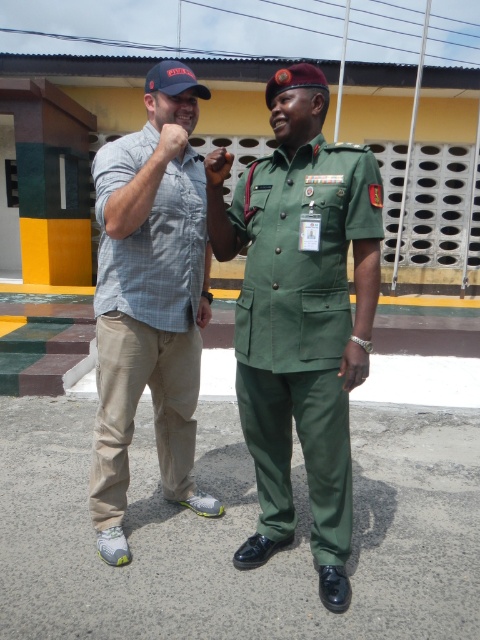
Question: Which point is closer to the camera?

Choices:
 (A) green fabric uniform at center
 (B) matte black watch at upper center

Answer: (A)

Question: Does light brown cotton pants at left lie in front of matte black watch at upper center?

Choices:
 (A) yes
 (B) no

Answer: (A)

Question: Which point is farther to the camera?

Choices:
 (A) (172, 131)
 (B) (228, 157)
 (C) (176, 429)

Answer: (C)

Question: Can you confirm if light brown cotton pants at left is positioned below matte black watch at upper center?

Choices:
 (A) no
 (B) yes

Answer: (B)

Question: Can you confirm if green fabric uniform at center is positioned to the left of matte black watch at upper center?

Choices:
 (A) yes
 (B) no

Answer: (B)

Question: Which object is the farthest from the green fabric uniform at center?

Choices:
 (A) light brown cotton pants at left
 (B) matte gray shirt at upper left

Answer: (B)